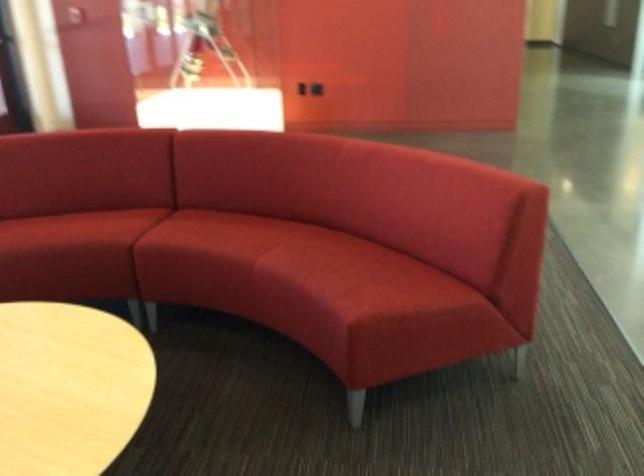
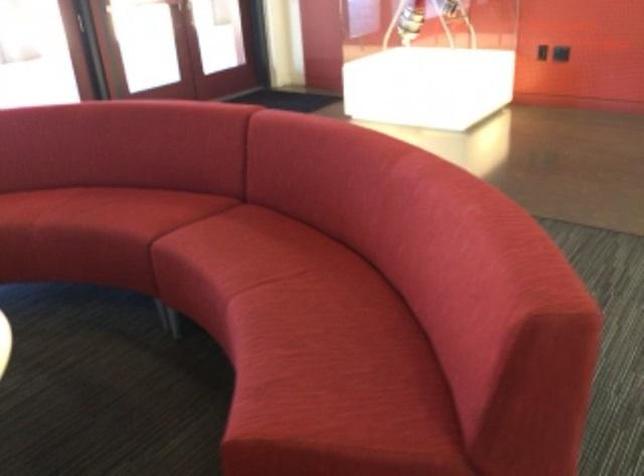
Which direction would the cameraman need to move to produce the second image?

The movement direction of the cameraman is right, forward.